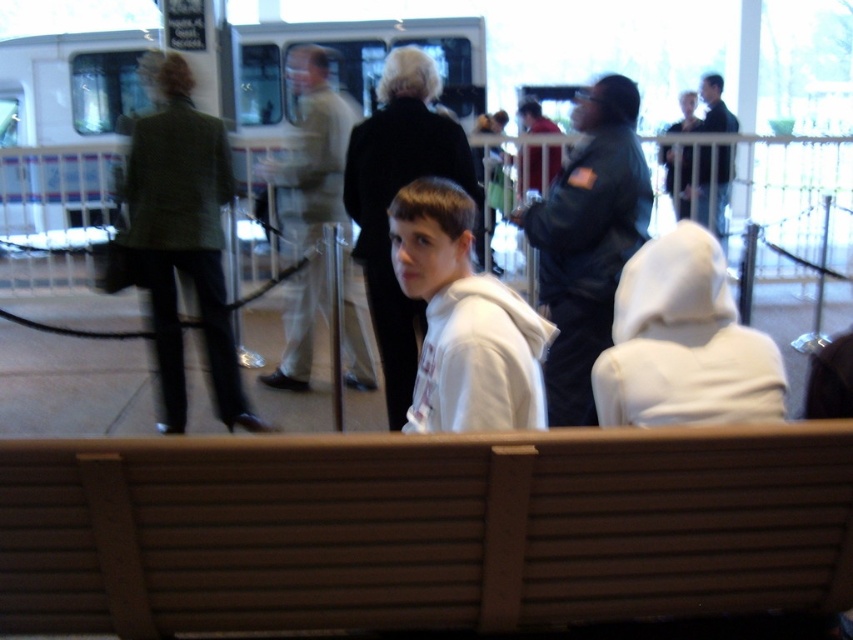
You are a passenger at the station and want to sit down. The brown wood bench at center is your only option. Can you sit on the bench without moving the green textured blazer at left?

The brown wood bench at center is located below green textured blazer at left, which means the blazer is likely hanging on the bench. Therefore, you can sit on the bench without moving the green textured blazer at left as it is positioned above it.